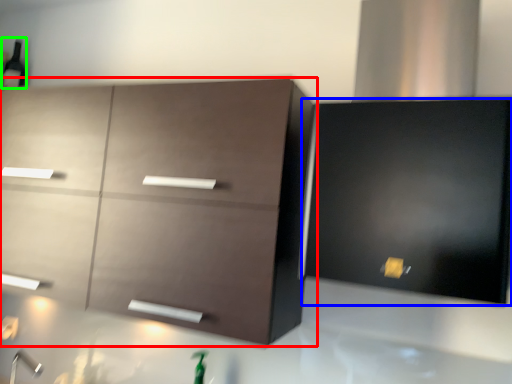
Question: Estimate the real-world distances between objects in this image. Which object is closer to cabinetry (highlighted by a red box), cabinetry (highlighted by a blue box) or beer bottle (highlighted by a green box)?

Choices:
 (A) cabinetry
 (B) beer bottle

Answer: (A)